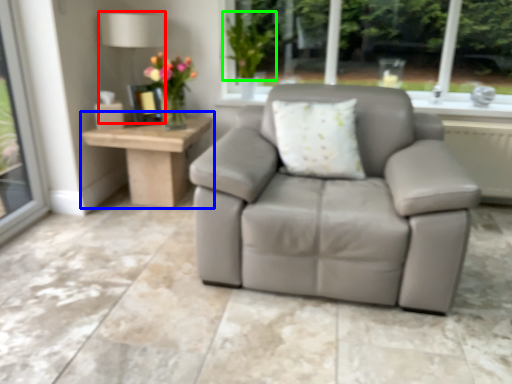
Question: Considering the real-world distances, which object is closest to lamp (highlighted by a red box)? table (highlighted by a blue box) or plant (highlighted by a green box).

Choices:
 (A) table
 (B) plant

Answer: (B)